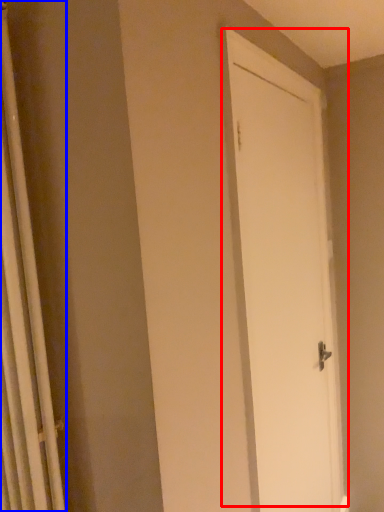
Question: Which object appears farthest to the camera in this image, door (highlighted by a red box) or shower curtain (highlighted by a blue box)?

Choices:
 (A) door
 (B) shower curtain

Answer: (A)